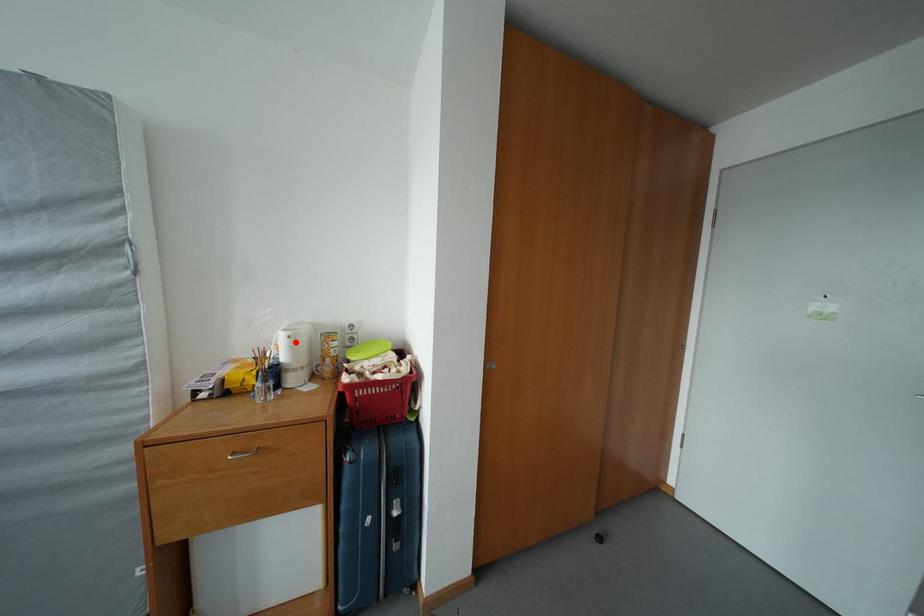
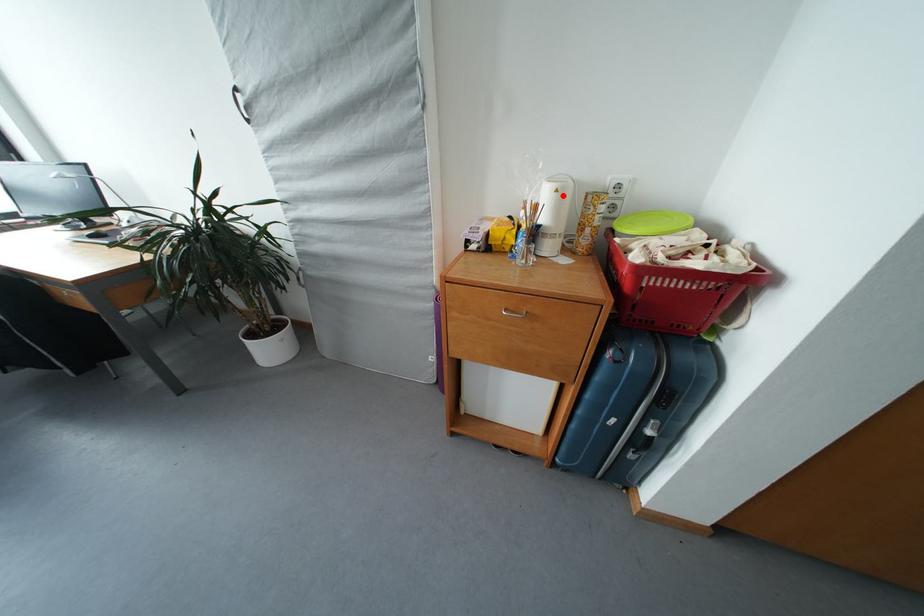
I am providing you with two images of the same scene from different viewpoints. A red point is marked on the first image and another point is marked on the second image. Is the marked point in image1 the same physical position as the marked point in image2?

Yes